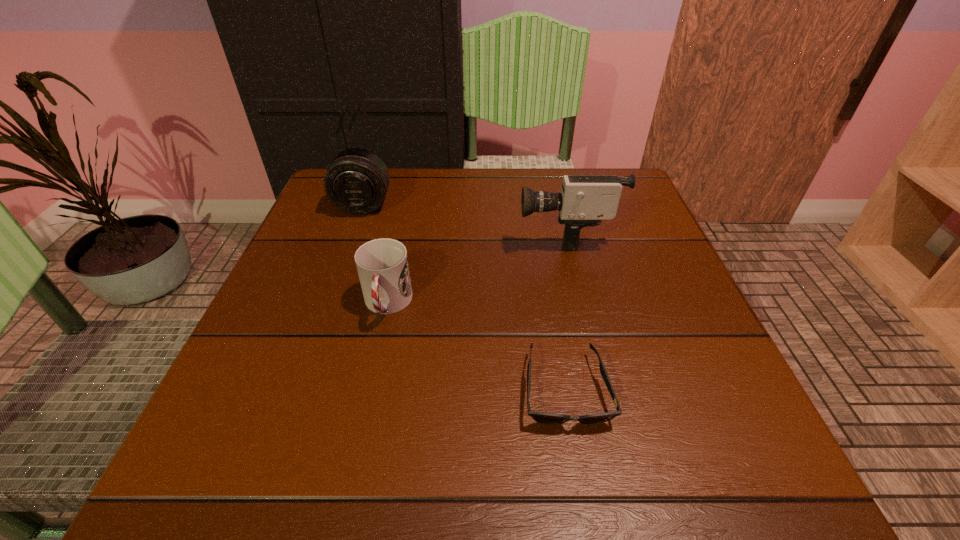
Locate an element on the screen. The height and width of the screenshot is (540, 960). unoccupied position between the camcorder and the shortest object is located at coordinates (565, 312).

You are a GUI agent. You are given a task and a screenshot of the screen. Output one action in this format:
    pyautogui.click(x=<x>, y=<y>)
    Task: Click on the free space between the cup and the camcorder
    This screenshot has width=960, height=540.
    Given the screenshot: What is the action you would take?
    pyautogui.click(x=476, y=269)

This screenshot has width=960, height=540. What are the coordinates of `free space between the nearest object and the third farthest object` in the screenshot? It's located at (476, 347).

Image resolution: width=960 pixels, height=540 pixels. Find the location of `vacant area between the camcorder and the cup`. vacant area between the camcorder and the cup is located at coordinates (476, 269).

Where is `object that is the third nearest to the tallest object`? object that is the third nearest to the tallest object is located at coordinates (357, 180).

Identify which object is located as the nearest to the shortest object. Please provide its 2D coordinates. Your answer should be formatted as a tuple, i.e. [(x, y)], where the tuple contains the x and y coordinates of a point satisfying the conditions above.

[(382, 264)]

Image resolution: width=960 pixels, height=540 pixels. What are the coordinates of `free space that satisfies the following two spatial constraints: 1. on the recording direction of the tallest object; 2. on the front-facing side of the nearest object` in the screenshot? It's located at (603, 389).

Where is `vacant area in the image that satisfies the following two spatial constraints: 1. on the recording direction of the camcorder; 2. on the front-facing side of the shortest object`? vacant area in the image that satisfies the following two spatial constraints: 1. on the recording direction of the camcorder; 2. on the front-facing side of the shortest object is located at coordinates (603, 389).

Find the location of a particular element. Image resolution: width=960 pixels, height=540 pixels. vacant area that satisfies the following two spatial constraints: 1. on the recording direction of the tallest object; 2. on the handle side of the third tallest object is located at coordinates (583, 305).

This screenshot has width=960, height=540. I want to click on free spot that satisfies the following two spatial constraints: 1. on the recording direction of the camcorder; 2. on the front-facing side of the nearest object, so click(x=603, y=389).